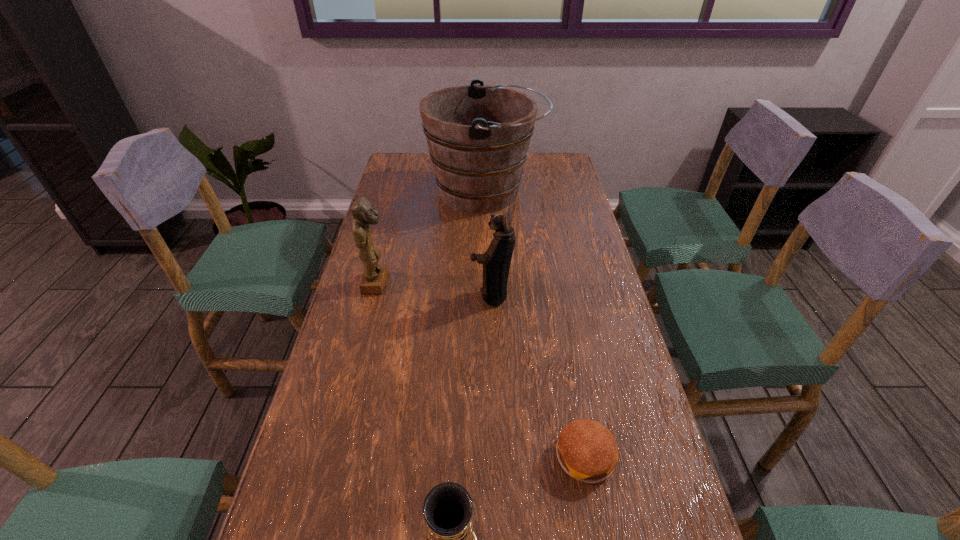
I want to click on free space located on the front-facing side of the leftmost object, so click(x=415, y=284).

Where is `vacant space located on the left of the second nearest object`? vacant space located on the left of the second nearest object is located at coordinates (422, 457).

Locate an element on the screen. The width and height of the screenshot is (960, 540). object positioned at the far edge is located at coordinates (478, 136).

What are the coordinates of `object that is at the left edge` in the screenshot? It's located at (374, 278).

Where is `bucket positioned at the right edge`? The height and width of the screenshot is (540, 960). bucket positioned at the right edge is located at coordinates (478, 136).

At what (x,y) coordinates should I click in order to perform the action: click on hamburger located in the right edge section of the desktop. Please return your answer as a coordinate pair (x, y). Image resolution: width=960 pixels, height=540 pixels. Looking at the image, I should click on (587, 451).

Where is `object that is at the far right corner`? object that is at the far right corner is located at coordinates (478, 136).

Identify the location of vacant area at the far edge. (530, 159).

You are a GUI agent. You are given a task and a screenshot of the screen. Output one action in this format:
    pyautogui.click(x=<x>, y=<y>)
    Task: Click on the blank space at the left edge of the desktop
    The width and height of the screenshot is (960, 540).
    Given the screenshot: What is the action you would take?
    pyautogui.click(x=379, y=208)

Find the location of a particular element. Image resolution: width=960 pixels, height=540 pixels. vacant space at the right edge is located at coordinates (566, 219).